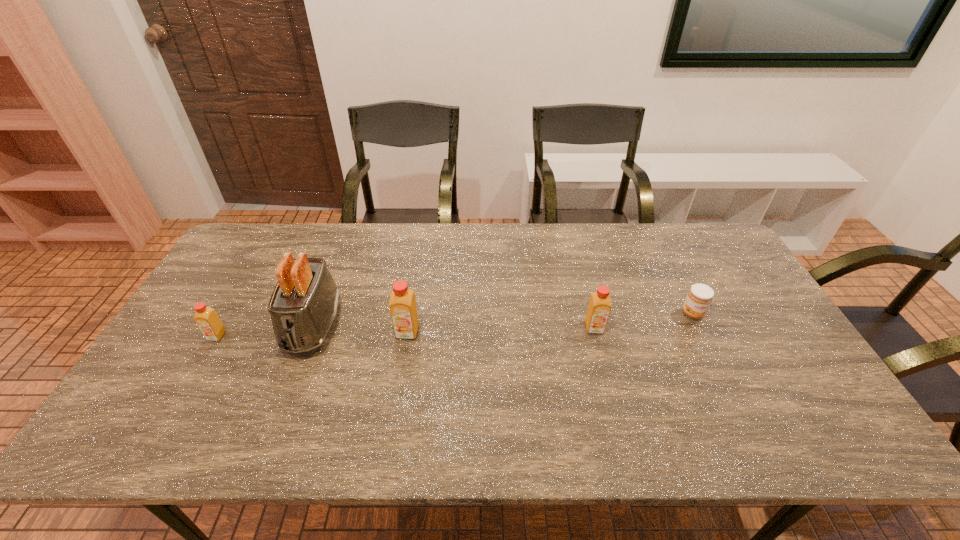
At what (x,y) coordinates should I click in order to perform the action: click on vacant region located 0.100m on the front and back of the second shortest object. Please return your answer as a coordinate pair (x, y). This screenshot has width=960, height=540. Looking at the image, I should click on tap(196, 372).

This screenshot has height=540, width=960. In order to click on blank space located 0.110m on the front and back of the second orange juice from left to right in this screenshot , I will do pos(400,374).

You are a GUI agent. You are given a task and a screenshot of the screen. Output one action in this format:
    pyautogui.click(x=<x>, y=<y>)
    Task: Click on the free spot located on the front and back of the third tallest object
    
    Given the screenshot: What is the action you would take?
    pyautogui.click(x=610, y=387)

Where is `vacant space located on the side of the tallest object with the control lever`? vacant space located on the side of the tallest object with the control lever is located at coordinates (292, 382).

The image size is (960, 540). I want to click on free space located on the front label of the jam, so click(x=711, y=353).

The width and height of the screenshot is (960, 540). In order to click on object located at the left edge in this screenshot , I will do click(206, 318).

Locate an element on the screen. The image size is (960, 540). vacant space at the far edge of the desktop is located at coordinates (639, 256).

Find the location of a particular element. The width and height of the screenshot is (960, 540). vacant space at the near edge is located at coordinates (471, 390).

Identify the location of vacant space at the far left corner of the desktop. (243, 235).

Image resolution: width=960 pixels, height=540 pixels. I want to click on vacant space at the near right corner, so click(821, 404).